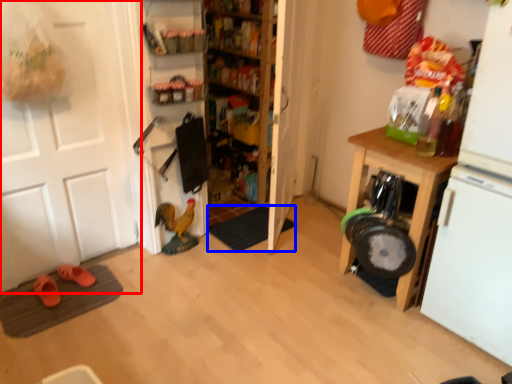
Question: Which point is further to the camera, door (highlighted by a red box) or doormat (highlighted by a blue box)?

Choices:
 (A) door
 (B) doormat

Answer: (B)